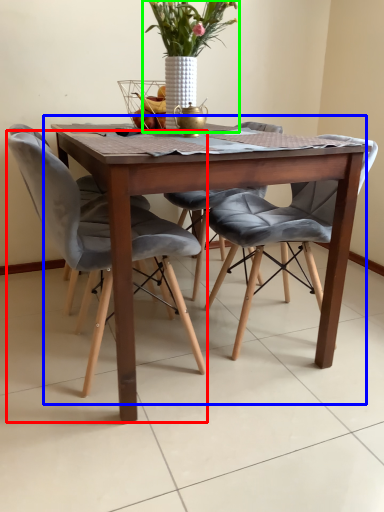
Question: Which is nearer to the chair (highlighted by a red box)? kitchen & dining room table (highlighted by a blue box) or houseplant (highlighted by a green box).

Choices:
 (A) kitchen & dining room table
 (B) houseplant

Answer: (A)